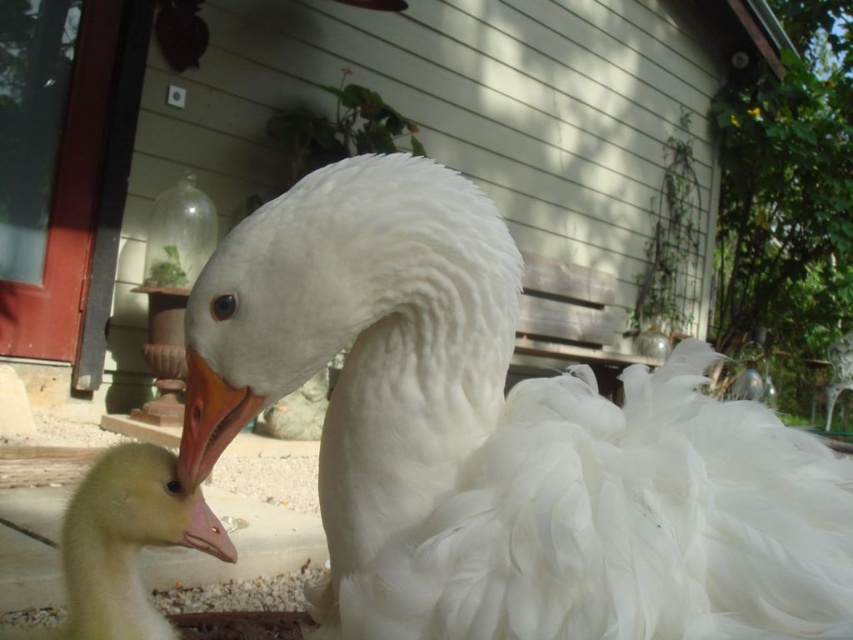
You are standing in the backyard and want to place a small treat exactly where the orange matte beak at center is currently located. Since the beak is part of the adult goose, you need to ensure the treat is placed on the gravel ground. Given the coordinates provided, can you confirm the exact 2D coordinates where you should place the treat?

The orange matte beak at center is located at the 2D coordinates point (209,419), so you should place the treat at those coordinates on the gravel ground.

You are a photographer aiming to capture the yellow downy goose at lower left and the orange matte beak at center in a single frame. Which object should you adjust your camera to focus on first to ensure both are in the shot without zooming?

The yellow downy goose at lower left is wider than the orange matte beak at center, so you should focus on the yellow downy goose at lower left first to ensure the entire width of both objects fits in the frame.

You are standing at the entrance of the house and want to walk towards the two points marked in the image. Which point, point (231, 438) or point (213, 518), will you reach first?

Point (231, 438) is in front of point (213, 518), so you will reach point (231, 438) first.